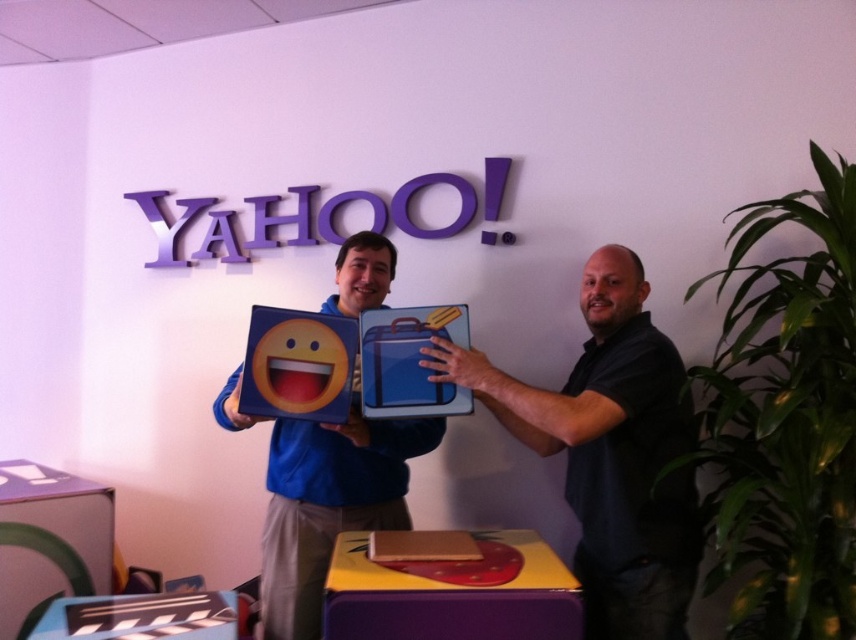
You are organizing items on a table and need to place the matte cardboard box at lower left and the matte blue clapperboard at center. Which object should you move first to free up space for another item?

The matte cardboard box at lower left is positioned over the matte blue clapperboard at center, so you should move the matte cardboard box at lower left first to free up space for another item.

You are organizing a small event and need to stack items on a shelf. You have the blue matte emoji box at center and the blue fabric suitcase at center. Which item should you place at the bottom to ensure stability?

The blue matte emoji box at center should be placed at the bottom since it has a greater height than the blue fabric suitcase at center, providing a stable base for stacking.